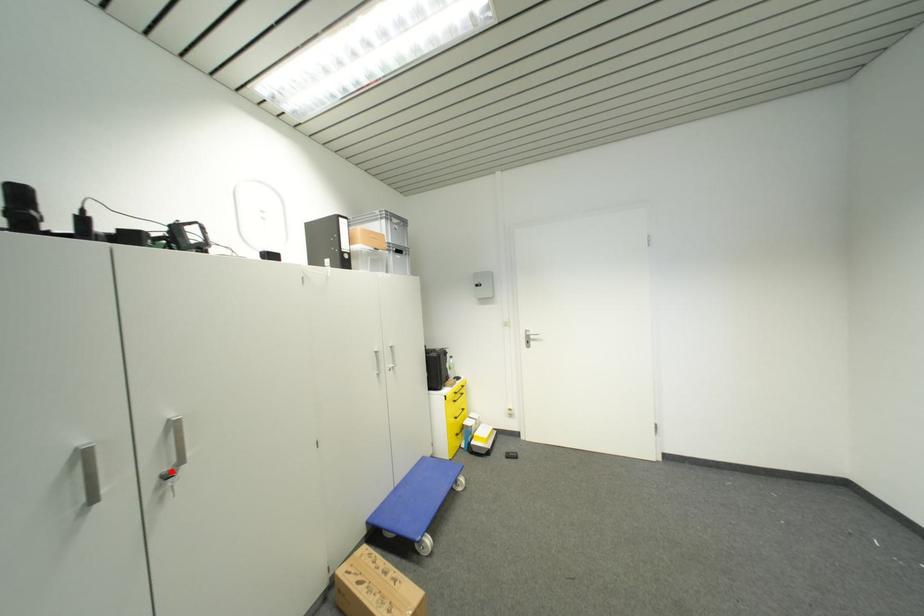
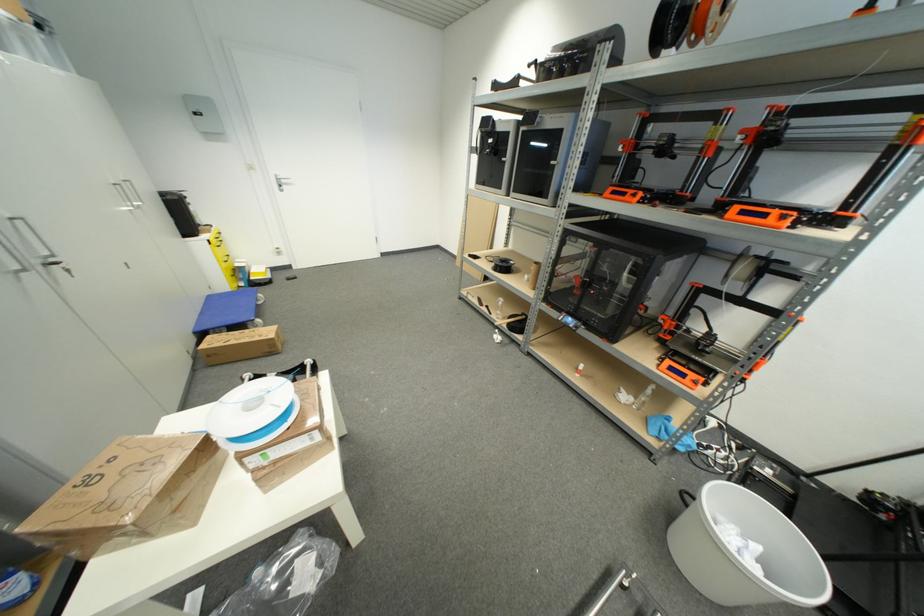
Locate, in the second image, the point that corresponds to the highlighted location in the first image.

(43, 264)